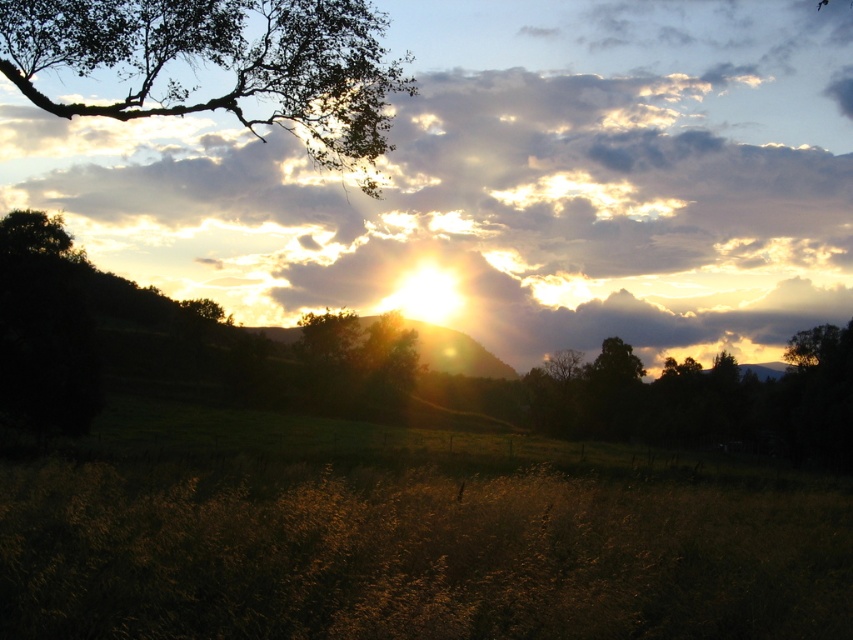
Does green matte tree at center have a lesser width compared to brown textured tree at center?

No.

Looking at this image, can you confirm if green matte tree at center is positioned to the left of brown textured tree at center?

Indeed, green matte tree at center is positioned on the left side of brown textured tree at center.

Does point (413, 342) come behind point (567, 368)?

No, (413, 342) is in front of (567, 368).

At what (x,y) coordinates should I click in order to perform the action: click on green matte tree at center. Please return your answer as a coordinate pair (x, y). Looking at the image, I should click on (387, 360).

Is green leafy tree at upper left above green matte tree at center?

Yes.

Describe the element at coordinates (221, 65) in the screenshot. The height and width of the screenshot is (640, 853). I see `green leafy tree at upper left` at that location.

Does point (247, 35) come behind point (401, 349)?

No, it is in front of (401, 349).

Locate an element on the screen. The height and width of the screenshot is (640, 853). green leafy tree at upper left is located at coordinates (221, 65).

Does green leafy tree at upper left lie in front of brown textured tree at center?

Yes, it is.

Can you confirm if green leafy tree at upper left is shorter than brown textured tree at center?

No.

Is point (160, 10) less distant than point (556, 371)?

That is True.

This screenshot has height=640, width=853. I want to click on green leafy tree at upper left, so click(x=221, y=65).